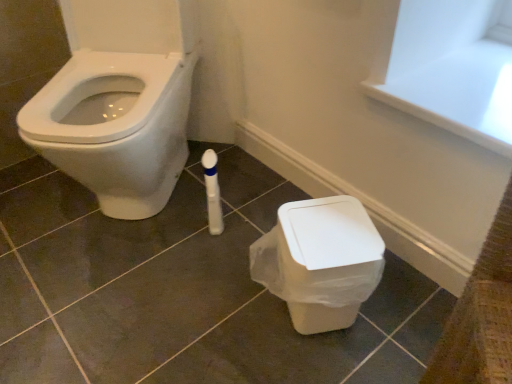
Question: From the image's perspective, is matte white tile at center below white glossy bidet at left?

Choices:
 (A) yes
 (B) no

Answer: (A)

Question: Is matte white tile at center facing away from white glossy bidet at left?

Choices:
 (A) no
 (B) yes

Answer: (A)

Question: Is matte white tile at center at the left side of white glossy bidet at left?

Choices:
 (A) no
 (B) yes

Answer: (A)

Question: Is white glossy bidet at left a part of matte white tile at center?

Choices:
 (A) no
 (B) yes

Answer: (A)

Question: Considering the relative sizes of matte white tile at center and white glossy bidet at left in the image provided, is matte white tile at center thinner than white glossy bidet at left?

Choices:
 (A) no
 (B) yes

Answer: (A)

Question: Does matte white tile at center have a larger size compared to white glossy bidet at left?

Choices:
 (A) yes
 (B) no

Answer: (B)

Question: Is white plastic bin at lower right oriented towards matte white tile at center?

Choices:
 (A) yes
 (B) no

Answer: (B)

Question: Is white plastic bin at lower right wider than matte white tile at center?

Choices:
 (A) no
 (B) yes

Answer: (A)

Question: Does white plastic bin at lower right have a lesser width compared to matte white tile at center?

Choices:
 (A) no
 (B) yes

Answer: (B)

Question: Is white plastic bin at lower right at the left side of matte white tile at center?

Choices:
 (A) no
 (B) yes

Answer: (A)

Question: From the image's perspective, is white plastic bin at lower right on matte white tile at center?

Choices:
 (A) no
 (B) yes

Answer: (A)

Question: Are white plastic bin at lower right and matte white tile at center located far from each other?

Choices:
 (A) no
 (B) yes

Answer: (A)

Question: From the image's perspective, does matte white tile at center appear lower than white plastic bin at lower right?

Choices:
 (A) yes
 (B) no

Answer: (B)